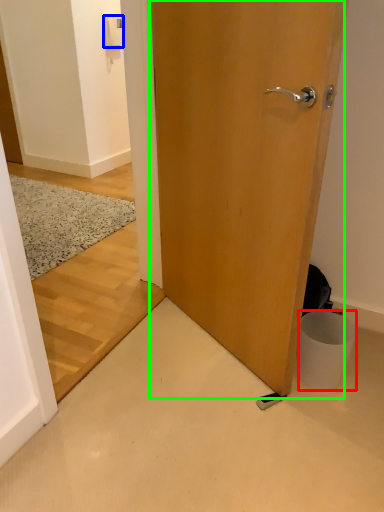
Question: Estimate the real-world distances between objects in this image. Which object is closer to trash bin/can (highlighted by a red box), light switch (highlighted by a blue box) or door (highlighted by a green box)?

Choices:
 (A) light switch
 (B) door

Answer: (B)